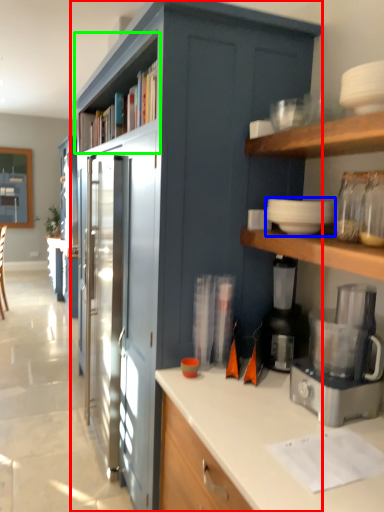
Question: Which is nearer to the cabinetry (highlighted by a red box)? appliance (highlighted by a blue box) or shelf (highlighted by a green box).

Choices:
 (A) appliance
 (B) shelf

Answer: (B)